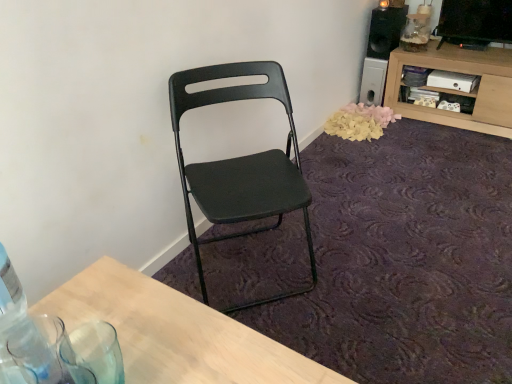
You are a GUI agent. You are given a task and a screenshot of the screen. Output one action in this format:
    pyautogui.click(x=<x>, y=<y>)
    Task: Click on the free spot above wooden cabinet at upper right (from a real-world perspective)
    The width and height of the screenshot is (512, 384).
    Given the screenshot: What is the action you would take?
    pyautogui.click(x=462, y=49)